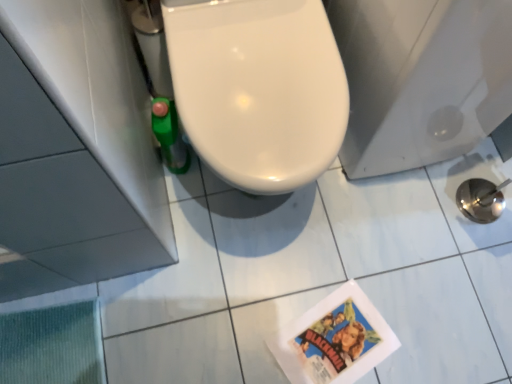
At what (x,y) coordinates should I click in order to perform the action: click on white glossy toilet at center. Please return your answer as a coordinate pair (x, y). Looking at the image, I should click on [x=421, y=79].

What do you see at coordinates (421, 79) in the screenshot?
I see `white glossy toilet at center` at bounding box center [421, 79].

I want to click on glossy ceramic tile at lower right, so click(460, 184).

What do you see at coordinates (460, 184) in the screenshot?
I see `glossy ceramic tile at lower right` at bounding box center [460, 184].

Identify the location of white glossy toilet at center. (421, 79).

Which is more to the left, white glossy toilet at center or glossy ceramic tile at lower right?

white glossy toilet at center.

Is white glossy toilet at center further to the viewer compared to glossy ceramic tile at lower right?

No.

Is point (441, 65) farther from viewer compared to point (486, 174)?

That is False.

From the image's perspective, does white glossy toilet at center appear lower than glossy ceramic tile at lower right?

No.

From a real-world perspective, is white glossy toilet at center on top of glossy ceramic tile at lower right?

Yes, from a real-world perspective, white glossy toilet at center is above glossy ceramic tile at lower right.

Looking at their sizes, would you say white glossy toilet at center is wider or thinner than glossy ceramic tile at lower right?

white glossy toilet at center is wider than glossy ceramic tile at lower right.

Which of these two, white glossy toilet at center or glossy ceramic tile at lower right, stands taller?

white glossy toilet at center is taller.

Is white glossy toilet at center bigger than glossy ceramic tile at lower right?

Yes.

Is glossy ceramic tile at lower right completely or partially inside white glossy toilet at center?

No, glossy ceramic tile at lower right is not inside white glossy toilet at center.

Are white glossy toilet at center and glossy ceramic tile at lower right making contact?

There is a gap between white glossy toilet at center and glossy ceramic tile at lower right.

Could you tell me if white glossy toilet at center is turned towards glossy ceramic tile at lower right?

Yes, white glossy toilet at center faces towards glossy ceramic tile at lower right.

How much distance is there between white glossy toilet at center and glossy ceramic tile at lower right?

white glossy toilet at center and glossy ceramic tile at lower right are 39.39 centimeters apart from each other.

Where is `ceramic tile behind the white glossy toilet at center`? The height and width of the screenshot is (384, 512). ceramic tile behind the white glossy toilet at center is located at coordinates (460, 184).

Between glossy ceramic tile at lower right and white glossy toilet at center, which one appears on the left side from the viewer's perspective?

white glossy toilet at center is more to the left.

Which object is closer to the camera, glossy ceramic tile at lower right or white glossy toilet at center?

white glossy toilet at center is more forward.

Is point (486, 144) positioned behind point (344, 166)?

That is True.

From the image's perspective, which is above, glossy ceramic tile at lower right or white glossy toilet at center?

white glossy toilet at center appears higher in the image.

From a real-world perspective, is glossy ceramic tile at lower right located higher than white glossy toilet at center?

No, from a real-world perspective, glossy ceramic tile at lower right is not on top of white glossy toilet at center.

Can you confirm if glossy ceramic tile at lower right is wider than white glossy toilet at center?

In fact, glossy ceramic tile at lower right might be narrower than white glossy toilet at center.

Considering the sizes of glossy ceramic tile at lower right and white glossy toilet at center in the image, is glossy ceramic tile at lower right taller or shorter than white glossy toilet at center?

Clearly, glossy ceramic tile at lower right is shorter compared to white glossy toilet at center.

From the picture: Can you confirm if glossy ceramic tile at lower right is bigger than white glossy toilet at center?

No, glossy ceramic tile at lower right is not bigger than white glossy toilet at center.

Would you say glossy ceramic tile at lower right is inside or outside white glossy toilet at center?

glossy ceramic tile at lower right lies outside white glossy toilet at center.

Are glossy ceramic tile at lower right and white glossy toilet at center making contact?

They are not placed beside each other.

Is glossy ceramic tile at lower right positioned with its back to white glossy toilet at center?

No, glossy ceramic tile at lower right is not facing away from white glossy toilet at center.

How many degrees apart are the facing directions of glossy ceramic tile at lower right and white glossy toilet at center?

The angle between the facing direction of glossy ceramic tile at lower right and the facing direction of white glossy toilet at center is 90 degrees.

Measure the distance from glossy ceramic tile at lower right to white glossy toilet at center.

glossy ceramic tile at lower right and white glossy toilet at center are 15.51 inches apart.

Where is `porcelain to the left of glossy ceramic tile at lower right`? The height and width of the screenshot is (384, 512). porcelain to the left of glossy ceramic tile at lower right is located at coordinates 421,79.

In order to click on porcelain that is on the left side of glossy ceramic tile at lower right in this screenshot , I will do `click(421, 79)`.

Locate an element on the screen. Image resolution: width=512 pixels, height=384 pixels. porcelain lying in front of the glossy ceramic tile at lower right is located at coordinates (421, 79).